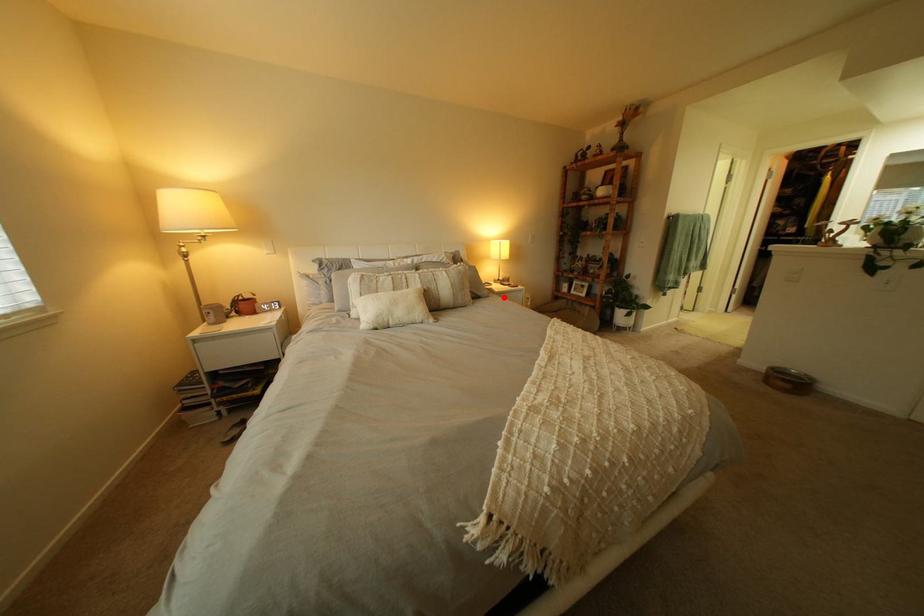
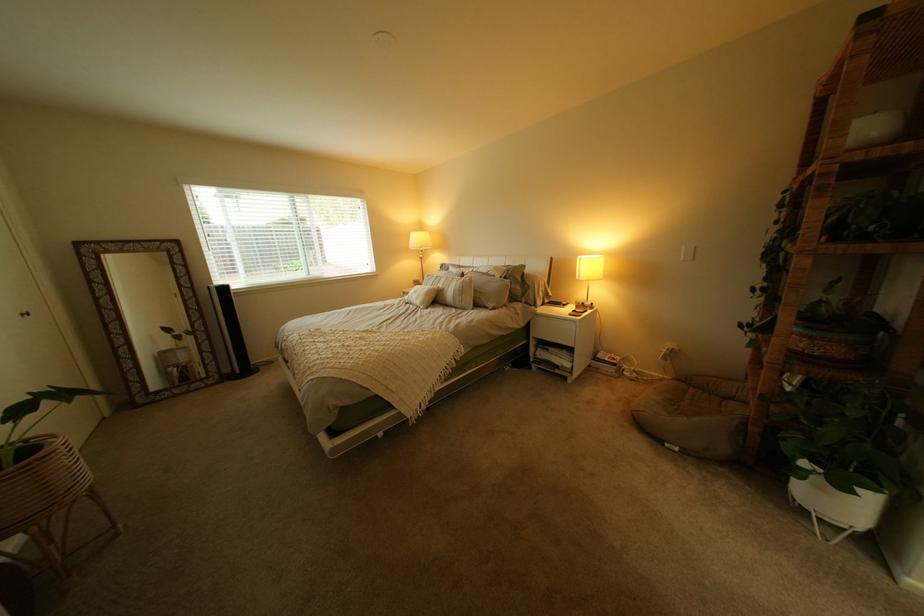
In the second image, find the point that corresponds to the highlighted location in the first image.

(509, 310)